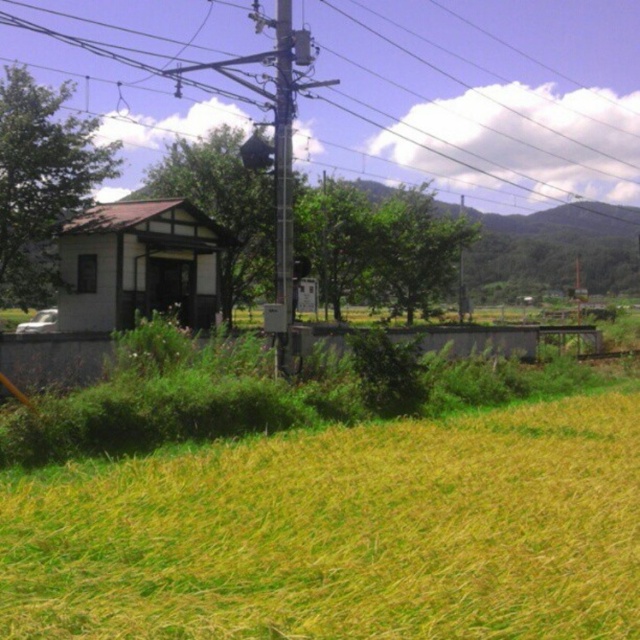
Is yellow grass at lower right bigger than metallic wire at upper center?

No, yellow grass at lower right is not bigger than metallic wire at upper center.

Between point (257, 486) and point (413, 28), which one is positioned in front?

Point (257, 486) is in front.

Is point (74, 612) positioned before point (520, 163)?

That is True.

Image resolution: width=640 pixels, height=640 pixels. In order to click on yellow grass at lower right in this screenshot , I will do `click(342, 532)`.

This screenshot has height=640, width=640. Describe the element at coordinates (477, 99) in the screenshot. I see `metallic wire at upper center` at that location.

Is point (157, 106) positioned in front of point (285, 244)?

No, it is behind (285, 244).

Is point (428, 60) farther from camera compared to point (285, 20)?

Yes.

This screenshot has height=640, width=640. I want to click on metallic wire at upper center, so click(x=477, y=99).

Who is more forward, (272, 518) or (285, 349)?

Point (272, 518) is more forward.

Identify the location of yellow grass at lower right. (342, 532).